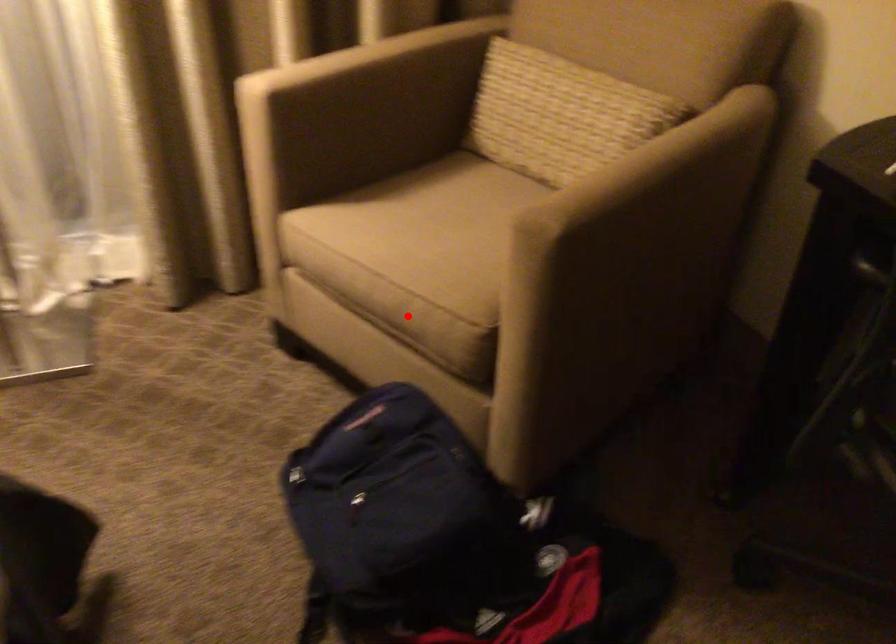
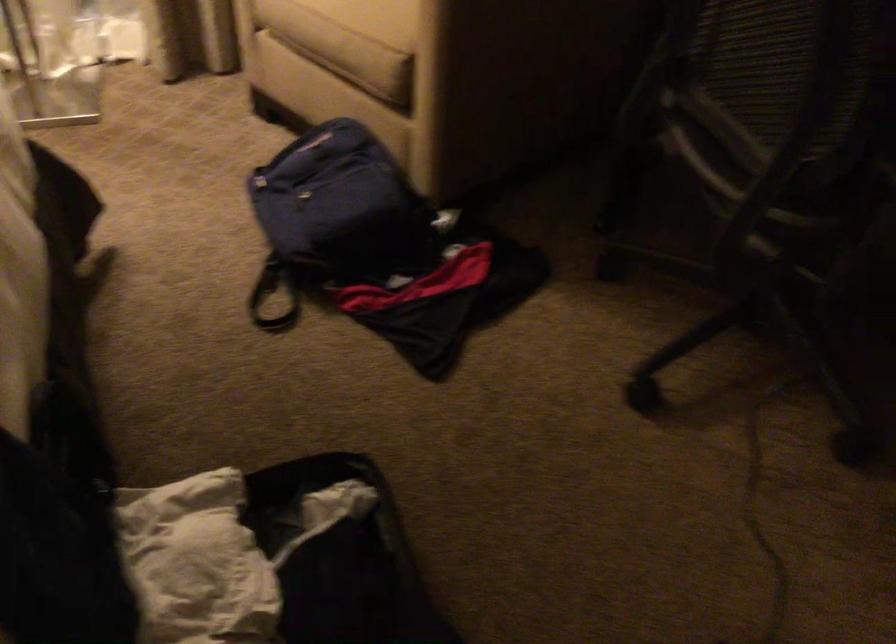
Question: I am providing you with two images of the same scene from different viewpoints. Image1 has a red point marked. In image2, the corresponding 3D location appears at what relative position? Reply with the corresponding letter.

Choices:
 (A) Closer
 (B) Farther

Answer: (B)